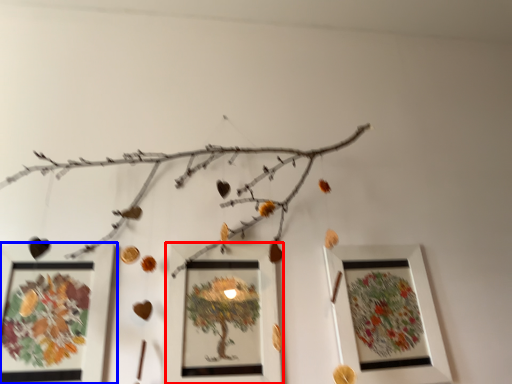
Question: Among these objects, which one is nearest to the camera, picture frame (highlighted by a red box) or picture frame (highlighted by a blue box)?

Choices:
 (A) picture frame
 (B) picture frame

Answer: (B)